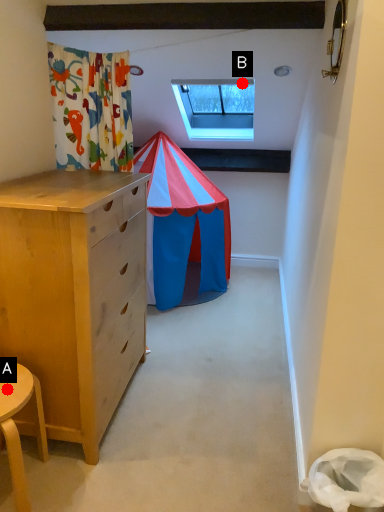
Question: Two points are circled on the image, labeled by A and B beside each circle. Among these points, which one is nearest to the camera?

Choices:
 (A) A is closer
 (B) B is closer

Answer: (A)